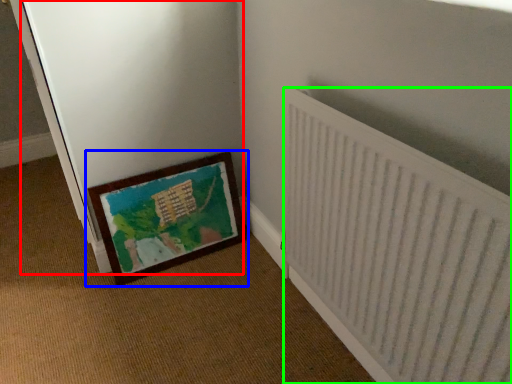
Question: Which object is the farthest from screen door (highlighted by a red box)? Choose among these: picture frame (highlighted by a blue box) or radiator (highlighted by a green box).

Choices:
 (A) picture frame
 (B) radiator

Answer: (B)